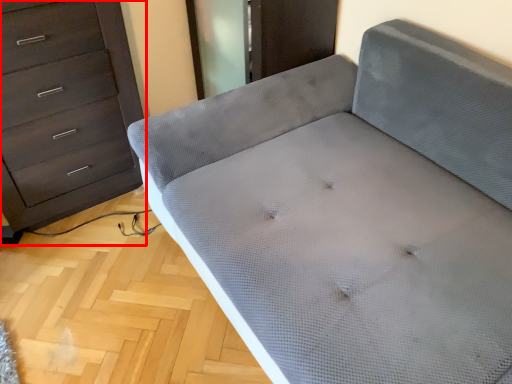
Question: From the image, what is the correct spatial relationship of chest of drawers (annotated by the red box) in relation to furniture?

Choices:
 (A) right
 (B) left

Answer: (B)